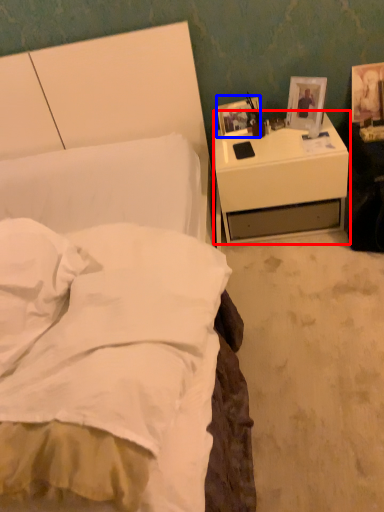
Question: Which object is closer to the camera taking this photo, nightstand (highlighted by a red box) or picture frame (highlighted by a blue box)?

Choices:
 (A) nightstand
 (B) picture frame

Answer: (A)